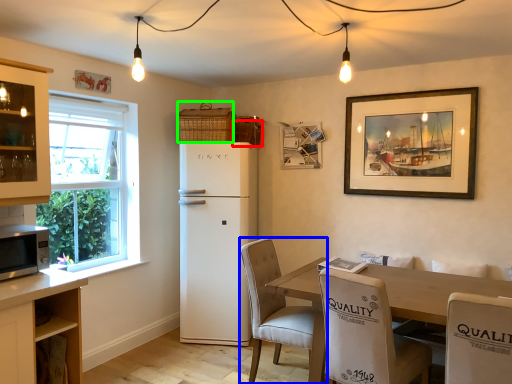
Question: Considering the real-world distances, which object is farthest from basket (highlighted by a red box)? chair (highlighted by a blue box) or basket (highlighted by a green box)?

Choices:
 (A) chair
 (B) basket

Answer: (A)